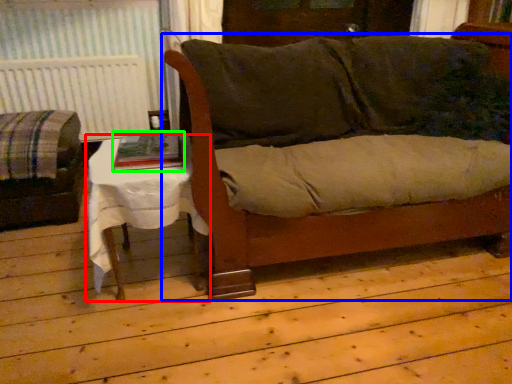
Question: Considering the real-world distances, which object is farthest from table (highlighted by a red box)? couch (highlighted by a blue box) or book (highlighted by a green box)?

Choices:
 (A) couch
 (B) book

Answer: (A)